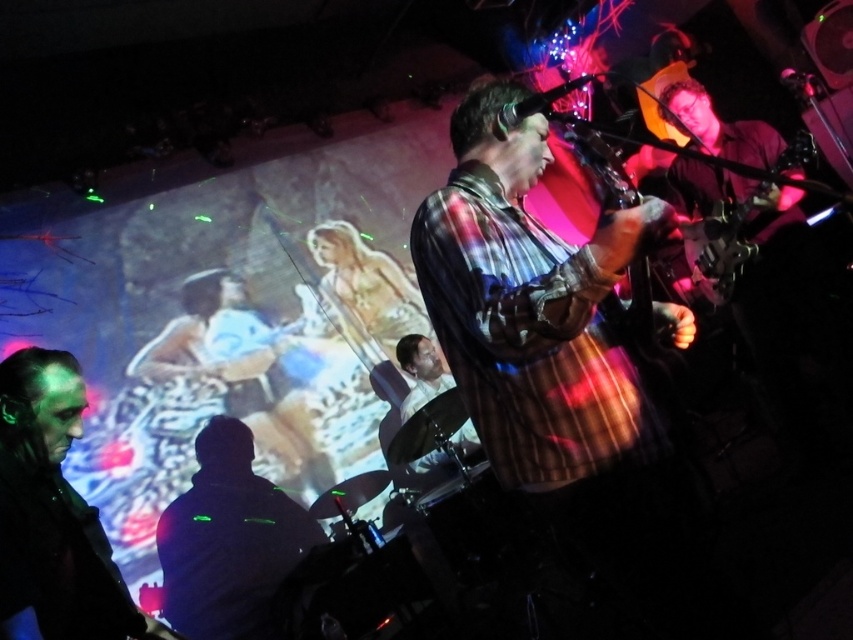
You are a stagehand who needs to move the plaid shirt guitar at center and the metallic guitar at center closer together to fit them into a storage case that is 1 meter wide. Can you move them close enough to fit into the case?

The plaid shirt guitar at center and metallic guitar at center are 1.33 meters apart, which is wider than the 1 meter storage case. Therefore, they need to be moved closer to fit into the case.